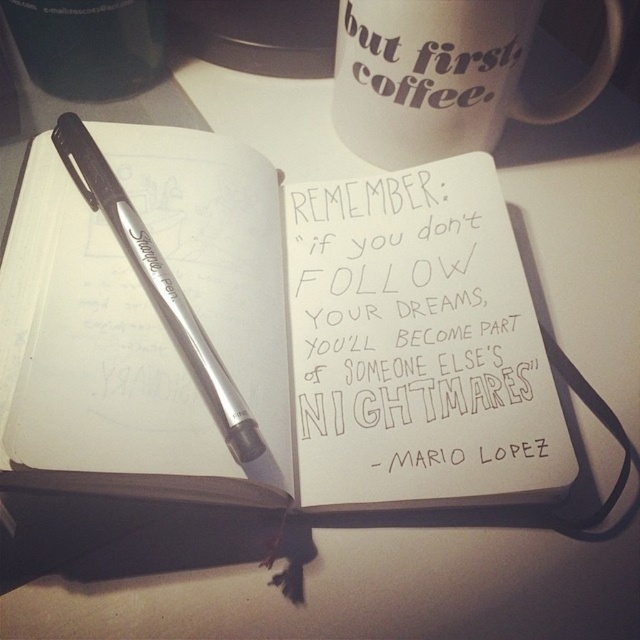
Is white handwritten text at center further to camera compared to metallic silver pen at upper left?

That is True.

Who is more distant from viewer, (310, 440) or (221, 428)?

Positioned behind is point (310, 440).

Where is `white handwritten text at center`? white handwritten text at center is located at coordinates [x=416, y=332].

The height and width of the screenshot is (640, 640). Find the location of `white handwritten text at center`. white handwritten text at center is located at coordinates (416, 332).

Can you confirm if white matte mug at upper center is positioned below metallic silver pen at upper left?

No, white matte mug at upper center is not below metallic silver pen at upper left.

Does white matte mug at upper center lie behind metallic silver pen at upper left?

Yes, white matte mug at upper center is behind metallic silver pen at upper left.

This screenshot has height=640, width=640. Describe the element at coordinates (444, 76) in the screenshot. I see `white matte mug at upper center` at that location.

Where is `white matte mug at upper center`? The width and height of the screenshot is (640, 640). white matte mug at upper center is located at coordinates (444, 76).

Does white handwritten text at center have a greater height compared to white matte mug at upper center?

Yes, white handwritten text at center is taller than white matte mug at upper center.

Is white handwritten text at center closer to the viewer compared to white matte mug at upper center?

Yes.

Which is in front, point (300, 193) or point (470, 116)?

Point (300, 193) is more forward.

Where is `white handwritten text at center`? The image size is (640, 640). white handwritten text at center is located at coordinates (416, 332).